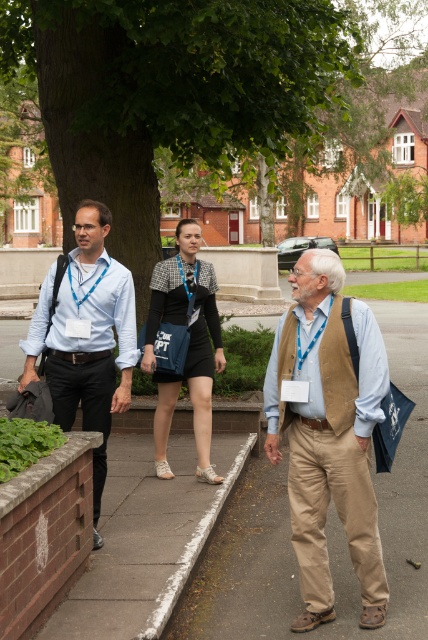
You are standing at the entrance of the residential area and see the khaki pants at center. Based on their position, can you estimate how far they are from the brick wall on their left?

The khaki pants at center is located at point (x=329, y=435), which places them closer to the brick wall on their left compared to the pathway edge. However, without specific measurements, an exact distance cannot be determined.

You are a delivery person with a cart that is 1.5 meters wide. You need to pass between the khaki pants at center and the matte blue shirt at left. Is there enough space for your cart to fit through?

The khaki pants at center and the matte blue shirt at left are 1.40 meters apart from each other. Since the cart is 1.5 meters wide, there is not enough space for the cart to fit through.